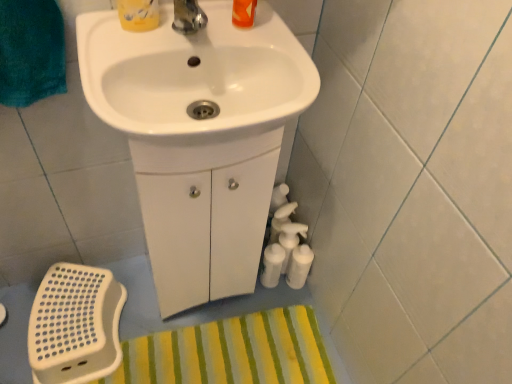
Question: Considering the positions of point (219, 129) and point (288, 370), is point (219, 129) closer or farther from the camera than point (288, 370)?

Choices:
 (A) farther
 (B) closer

Answer: (B)

Question: Considering the relative positions of white glossy sink at center, the second sink when ordered from front to back, and yellow striped bath mat at lower center in the image provided, is white glossy sink at center, the second sink when ordered from front to back, to the left or to the right of yellow striped bath mat at lower center?

Choices:
 (A) left
 (B) right

Answer: (B)

Question: Which is nearer to the yellow striped bath mat at lower center?

Choices:
 (A) matte yellow container at upper center
 (B) white glossy sink at center, the second sink when ordered from front to back
 (C) white glossy sink at upper center, which ranks as the 1th sink in front-to-back order

Answer: (B)

Question: Which object is the farthest from the white glossy sink at upper center, which ranks as the 1th sink in front-to-back order?

Choices:
 (A) yellow striped bath mat at lower center
 (B) matte yellow container at upper center
 (C) white glossy sink at center, the second sink when ordered from front to back

Answer: (A)